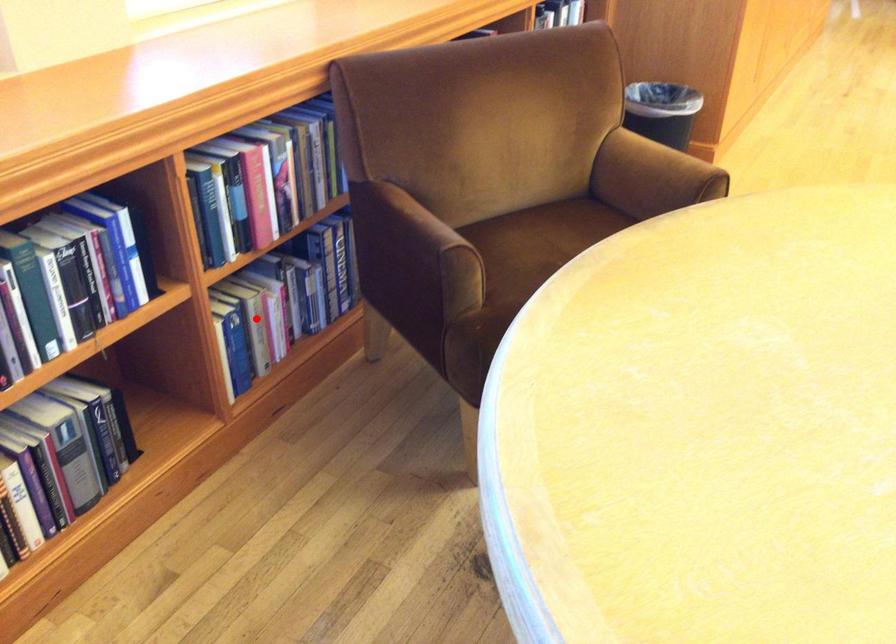
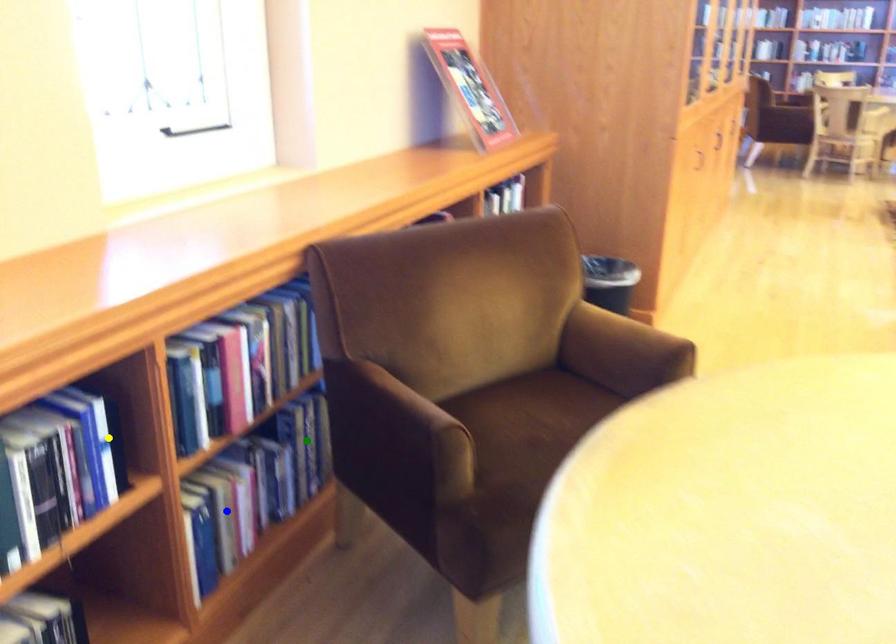
Question: I am providing you with two images of the same scene from different viewpoints. A red point is marked on the first image. You are given multiple points on the second image. Which point in image 2 represents the same 3d spot as the red point in image 1?

Choices:
 (A) green point
 (B) blue point
 (C) yellow point

Answer: (B)